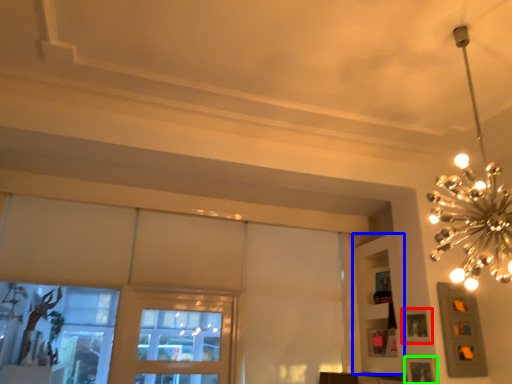
Question: Based on their relative distances, which object is nearer to picture frame (highlighted by a red box)? Choose from shelf (highlighted by a blue box) and picture frame (highlighted by a green box).

Choices:
 (A) shelf
 (B) picture frame

Answer: (B)